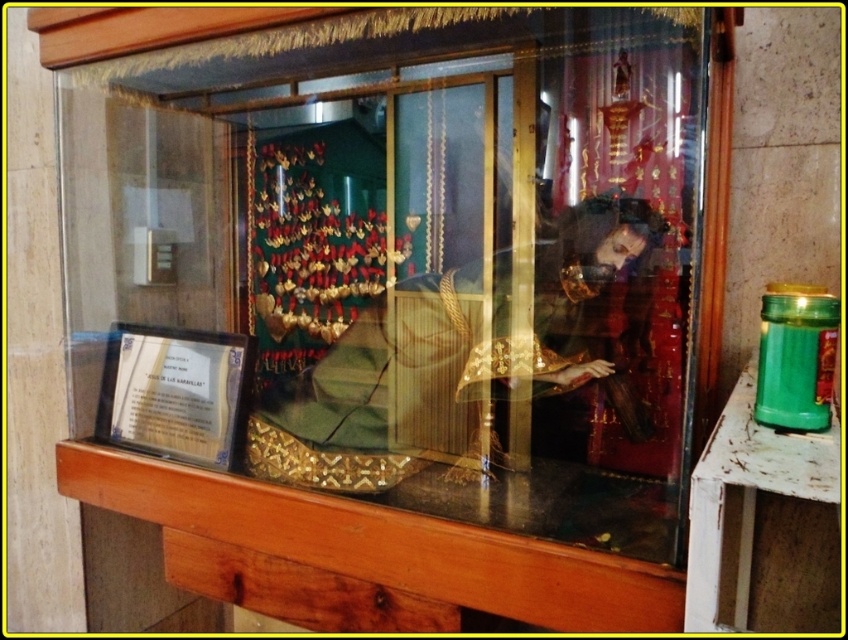
How distant is matte glass display case at center from gold textured fabric at center?

matte glass display case at center and gold textured fabric at center are 11.91 centimeters apart.

Does matte glass display case at center appear under gold textured fabric at center?

Actually, matte glass display case at center is above gold textured fabric at center.

The image size is (848, 640). What are the coordinates of `matte glass display case at center` in the screenshot? It's located at (402, 260).

Can you confirm if transparent glass door at center is positioned to the left of gold textured fabric at center?

Correct, you'll find transparent glass door at center to the left of gold textured fabric at center.

Which is below, transparent glass door at center or gold textured fabric at center?

gold textured fabric at center is lower down.

Describe the element at coordinates (416, 317) in the screenshot. The image size is (848, 640). I see `transparent glass door at center` at that location.

Identify the location of transparent glass door at center. The image size is (848, 640). (416, 317).

Is point (120, 356) positioned behind point (522, 422)?

Yes, it is.

The height and width of the screenshot is (640, 848). Find the location of `matte glass display case at center`. matte glass display case at center is located at coordinates (402, 260).